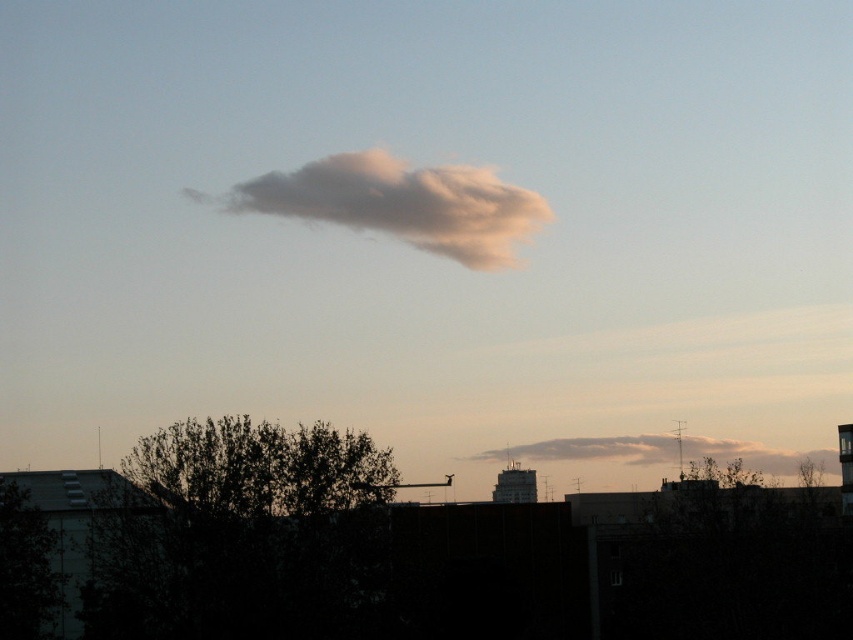
Looking at this image, based on the scene description, which tree is taller between the dark green leafy tree at lower center and the silhouette leafy tree at center?

The dark green leafy tree at lower center is much taller than the silhouette leafy tree at center.

You are a bird flying in the sky scene. You see a point at coordinate [247,536]. What object is located at that point?

The point at coordinate [247,536] corresponds to the dark green leafy tree at lower center.